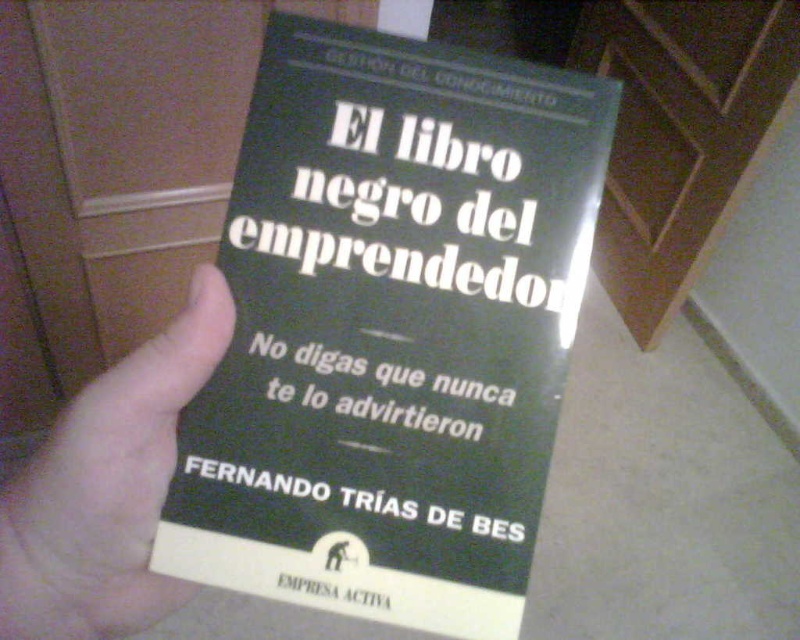
Question: Can you confirm if matte black book at center is thinner than skinny white hand at center?

Choices:
 (A) yes
 (B) no

Answer: (B)

Question: Which point is closer to the camera?

Choices:
 (A) (14, 614)
 (B) (572, 339)

Answer: (A)

Question: Where is matte black book at center located in relation to skinny white hand at center in the image?

Choices:
 (A) below
 (B) above

Answer: (B)

Question: Observing the image, what is the correct spatial positioning of matte black book at center in reference to skinny white hand at center?

Choices:
 (A) right
 (B) left

Answer: (A)